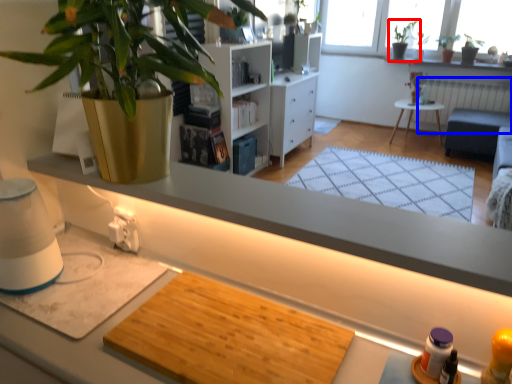
Question: Which object appears closest to the camera in this image, houseplant (highlighted by a red box) or radiator (highlighted by a blue box)?

Choices:
 (A) houseplant
 (B) radiator

Answer: (B)